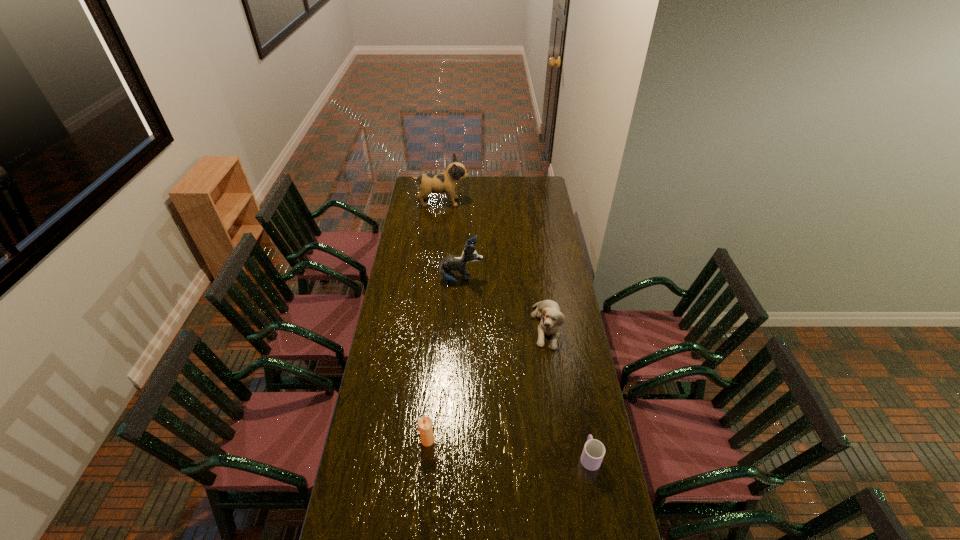
Where is `the tallest object`? The height and width of the screenshot is (540, 960). the tallest object is located at coordinates (446, 182).

The image size is (960, 540). Find the location of `the tallest puppy`. the tallest puppy is located at coordinates (446, 182).

Image resolution: width=960 pixels, height=540 pixels. What are the coordinates of `the second tallest object` in the screenshot? It's located at (447, 266).

The width and height of the screenshot is (960, 540). In order to click on the second tallest puppy in this screenshot , I will do `click(447, 266)`.

Image resolution: width=960 pixels, height=540 pixels. What are the coordinates of `candle` in the screenshot? It's located at (425, 428).

Locate an element on the screen. Image resolution: width=960 pixels, height=540 pixels. the rightmost puppy is located at coordinates click(x=549, y=312).

Image resolution: width=960 pixels, height=540 pixels. Identify the location of the nearest puppy. (549, 312).

This screenshot has height=540, width=960. Find the location of `cup`. cup is located at coordinates (593, 452).

Where is `blank area located at the face of the tallest puppy`? This screenshot has width=960, height=540. blank area located at the face of the tallest puppy is located at coordinates (492, 202).

The height and width of the screenshot is (540, 960). Identify the location of free space located on the front-facing side of the second shortest puppy. (541, 279).